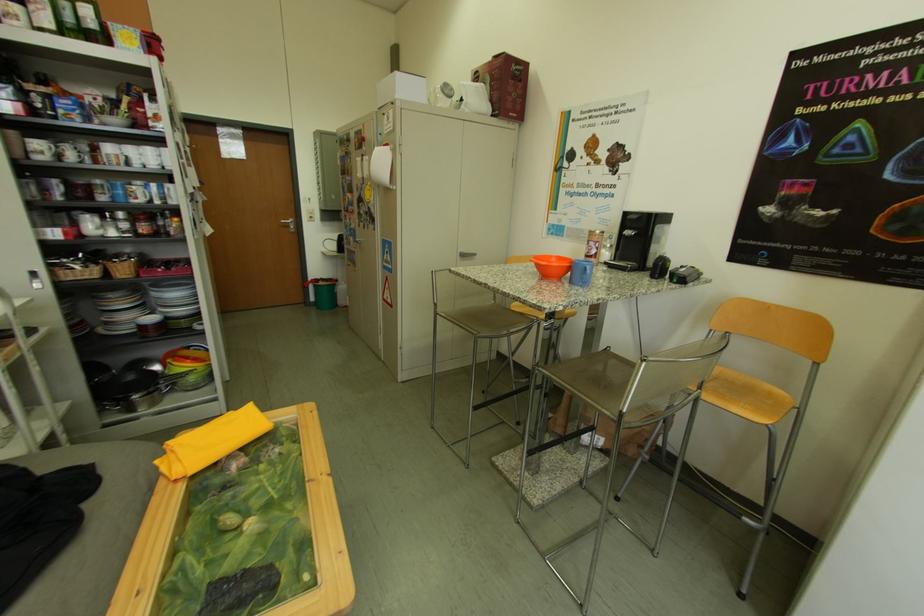
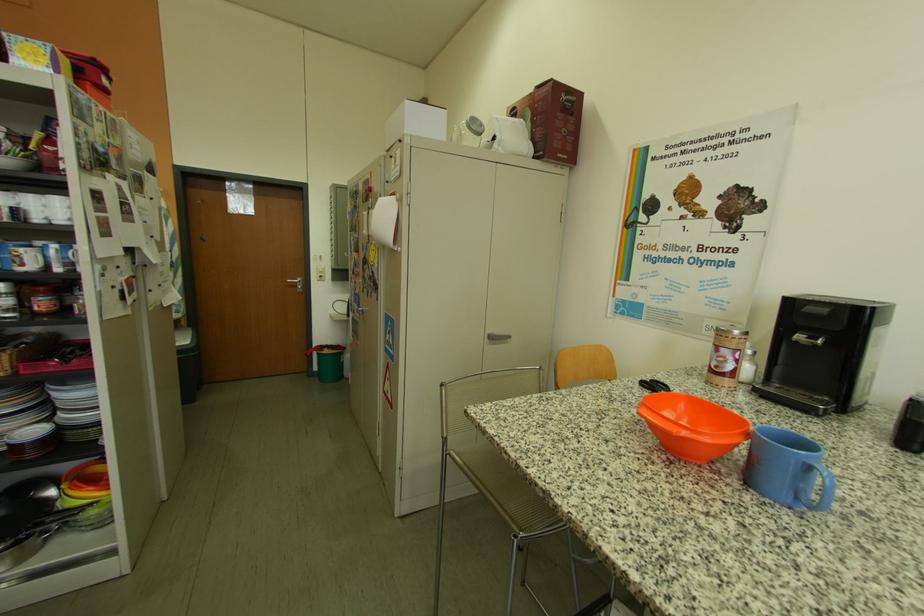
Question: What movement of the cameraman would produce the second image?

Choices:
 (A) Left
 (B) Right
 (C) Forward
 (D) Backward

Answer: (C)